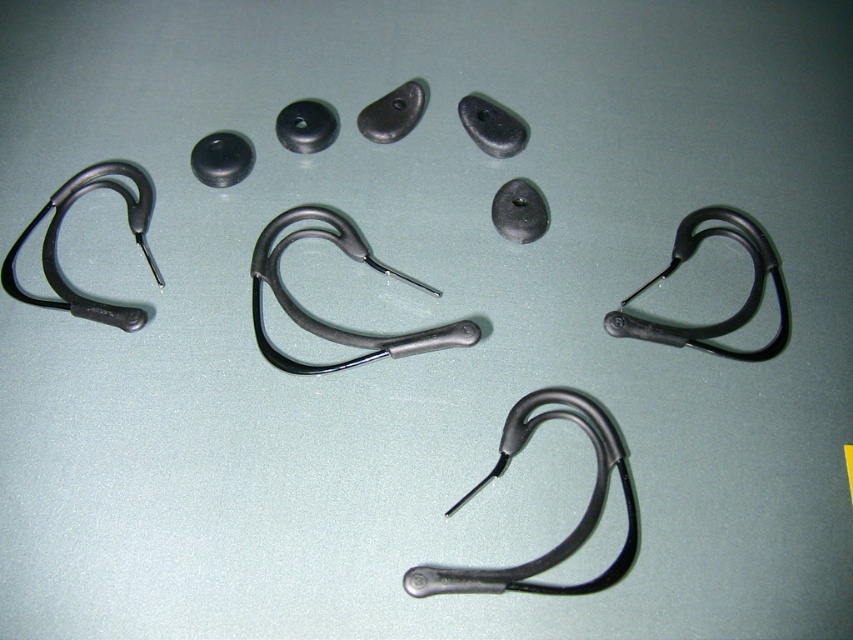
Question: Among these objects, which one is farthest from the camera?

Choices:
 (A) matte black earhook at center
 (B) black rubber earhook at upper right
 (C) matte black stethoscope at center
 (D) matte black earhook at left

Answer: (D)

Question: Based on their relative distances, which object is nearer to the matte black stethoscope at center?

Choices:
 (A) matte black earhook at center
 (B) matte black earhook at left

Answer: (B)

Question: Can you confirm if matte black earhook at center is wider than matte black earhook at left?

Choices:
 (A) yes
 (B) no

Answer: (A)

Question: Which object is closer to the camera taking this photo?

Choices:
 (A) matte black earhook at center
 (B) black rubber earhook at upper right
 (C) matte black earhook at left
 (D) matte black stethoscope at center

Answer: (A)

Question: Is matte black earhook at center below matte black earhook at left?

Choices:
 (A) yes
 (B) no

Answer: (A)

Question: Observing the image, what is the correct spatial positioning of matte black stethoscope at center in reference to black rubber earhook at upper right?

Choices:
 (A) above
 (B) below

Answer: (B)